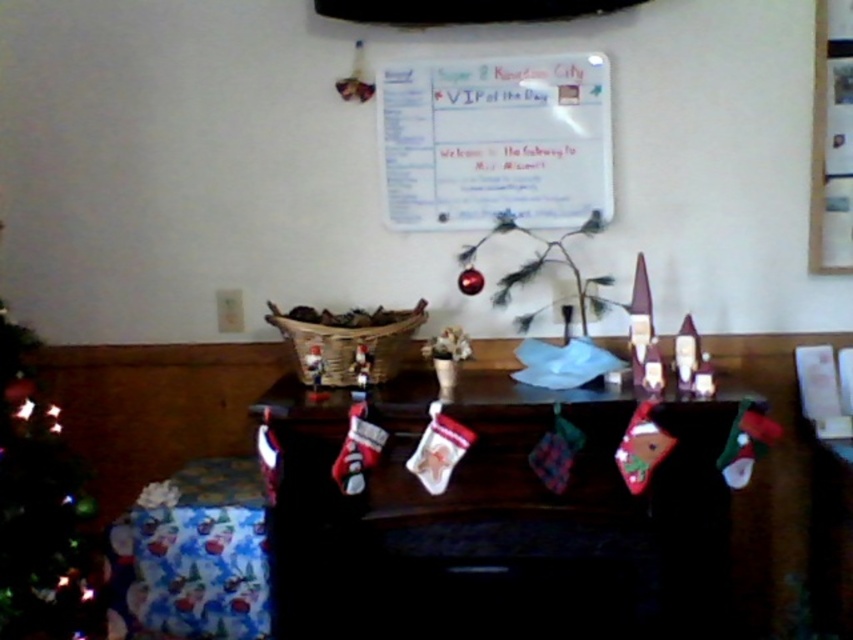
Question: Which point is farther to the camera?

Choices:
 (A) (257, 515)
 (B) (850, 92)
 (C) (570, 484)

Answer: (B)

Question: Does velvet red stockings at center have a smaller size compared to wrapping paper gift at lower left?

Choices:
 (A) no
 (B) yes

Answer: (A)

Question: Which point appears farthest from the camera in this image?

Choices:
 (A) (814, 268)
 (B) (622, 604)
 (C) (540, 132)
 (D) (30, 461)

Answer: (C)

Question: Estimate the real-world distances between objects in this image. Which object is farther from the wrapping paper gift at lower left?

Choices:
 (A) velvet red stockings at center
 (B) wooden picture frame at upper right

Answer: (B)

Question: In this image, where is velvet red stockings at center located relative to white paper at upper center?

Choices:
 (A) right
 (B) left

Answer: (A)

Question: In this image, where is velvet red stockings at center located relative to wrapping paper gift at lower left?

Choices:
 (A) left
 (B) right

Answer: (B)